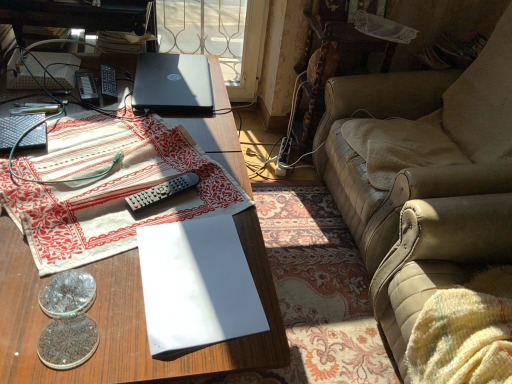
Question: Can you confirm if lace fabric at upper right is thinner than white paper at center, which is counted as the second paperback book, starting from the left?

Choices:
 (A) no
 (B) yes

Answer: (B)

Question: Considering the relative sizes of lace fabric at upper right and white paper at center, the 2th paperback book when ordered from top to bottom, in the image provided, is lace fabric at upper right wider than white paper at center, the 2th paperback book when ordered from top to bottom,?

Choices:
 (A) yes
 (B) no

Answer: (B)

Question: From a real-world perspective, does lace fabric at upper right sit lower than white paper at center, which is the first paperback book in right-to-left order?

Choices:
 (A) yes
 (B) no

Answer: (B)

Question: Is lace fabric at upper right placed right next to white paper at center, which is the first paperback book in right-to-left order?

Choices:
 (A) no
 (B) yes

Answer: (A)

Question: Does lace fabric at upper right have a greater height compared to white paper at center, which appears as the first paperback book when ordered from the bottom?

Choices:
 (A) yes
 (B) no

Answer: (A)

Question: Looking at their shapes, would you say black plastic remote control at center, which ranks as the 2th remote control in left-to-right order, is wider or thinner than satin black laptop at upper center?

Choices:
 (A) wide
 (B) thin

Answer: (B)

Question: From the image's perspective, is black plastic remote control at center, the third remote control viewed from the front, above or below satin black laptop at upper center?

Choices:
 (A) above
 (B) below

Answer: (B)

Question: Considering the relative positions of black plastic remote control at center, which ranks as the 2th remote control in left-to-right order, and satin black laptop at upper center in the image provided, is black plastic remote control at center, which ranks as the 2th remote control in left-to-right order, to the left or to the right of satin black laptop at upper center?

Choices:
 (A) left
 (B) right

Answer: (A)

Question: Does point (114, 74) appear closer or farther from the camera than point (150, 96)?

Choices:
 (A) closer
 (B) farther

Answer: (B)

Question: Considering the positions of point (37, 374) and point (193, 173), is point (37, 374) closer or farther from the camera than point (193, 173)?

Choices:
 (A) closer
 (B) farther

Answer: (A)

Question: Would you say wooden desk at center is to the left or to the right of gray plastic remote at center, acting as the first remote control starting from the front, in the picture?

Choices:
 (A) left
 (B) right

Answer: (A)

Question: Is wooden desk at center taller or shorter than gray plastic remote at center, the 3th remote control viewed from the back?

Choices:
 (A) short
 (B) tall

Answer: (B)

Question: Based on their sizes in the image, would you say wooden desk at center is bigger or smaller than gray plastic remote at center, which ranks as the first remote control in right-to-left order?

Choices:
 (A) big
 (B) small

Answer: (A)

Question: Looking at the image, does gray plastic remote at center, the third remote control when ordered from left to right, seem bigger or smaller compared to wooden desk at center?

Choices:
 (A) big
 (B) small

Answer: (B)

Question: From the image's perspective, is gray plastic remote at center, the 3th remote control viewed from the back, located above or below wooden desk at center?

Choices:
 (A) above
 (B) below

Answer: (A)